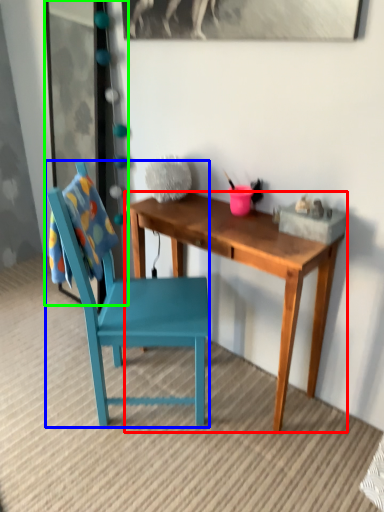
Question: Which object is positioned farthest from desk (highlighted by a red box)? Select from chair (highlighted by a blue box) and glass door (highlighted by a green box).

Choices:
 (A) chair
 (B) glass door

Answer: (B)